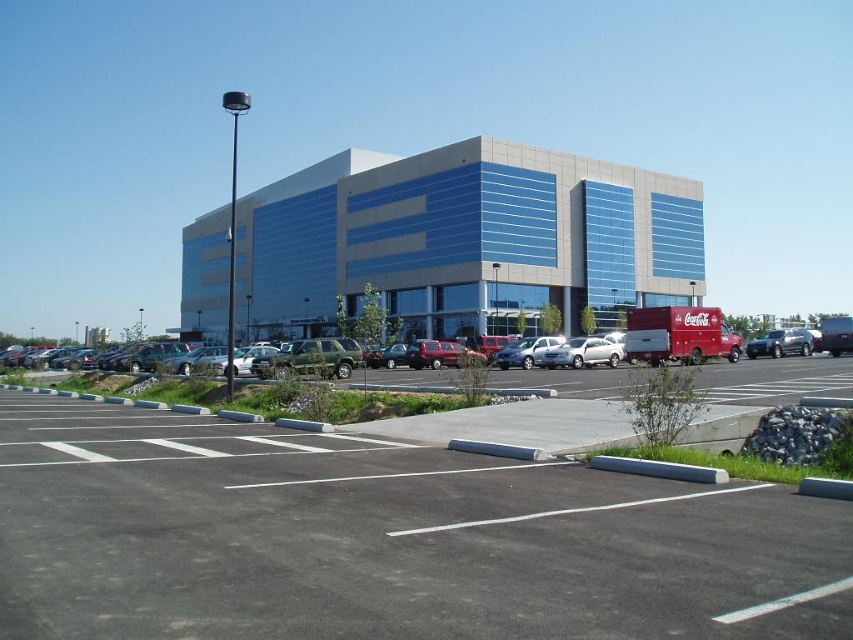
Is black asphalt parking lot at center to the right of shiny silver sedan at right from the viewer's perspective?

In fact, black asphalt parking lot at center is to the left of shiny silver sedan at right.

Is point (727, 522) less distant than point (796, 346)?

Yes, it is in front of point (796, 346).

At what (x,y) coordinates should I click in order to perform the action: click on black asphalt parking lot at center. Please return your answer as a coordinate pair (x, y). Looking at the image, I should click on (384, 540).

This screenshot has width=853, height=640. Find the location of `black asphalt parking lot at center`. black asphalt parking lot at center is located at coordinates (384, 540).

Between shiny silver sedan at right and satin silver sedan at center, which one has more height?

Standing taller between the two is shiny silver sedan at right.

Which is more to the left, shiny silver sedan at right or satin silver sedan at center?

Positioned to the left is satin silver sedan at center.

Is point (764, 344) in front of point (519, 355)?

No, it is not.

Locate an element on the screen. Image resolution: width=853 pixels, height=640 pixels. shiny silver sedan at right is located at coordinates pos(780,342).

Which is in front, point (181, 497) or point (560, 342)?

Positioned in front is point (181, 497).

Who is taller, black asphalt parking lot at center or satin silver sedan at center?

Standing taller between the two is satin silver sedan at center.

You are a GUI agent. You are given a task and a screenshot of the screen. Output one action in this format:
    pyautogui.click(x=<x>, y=<y>)
    Task: Click on the black asphalt parking lot at center
    
    Given the screenshot: What is the action you would take?
    pyautogui.click(x=384, y=540)